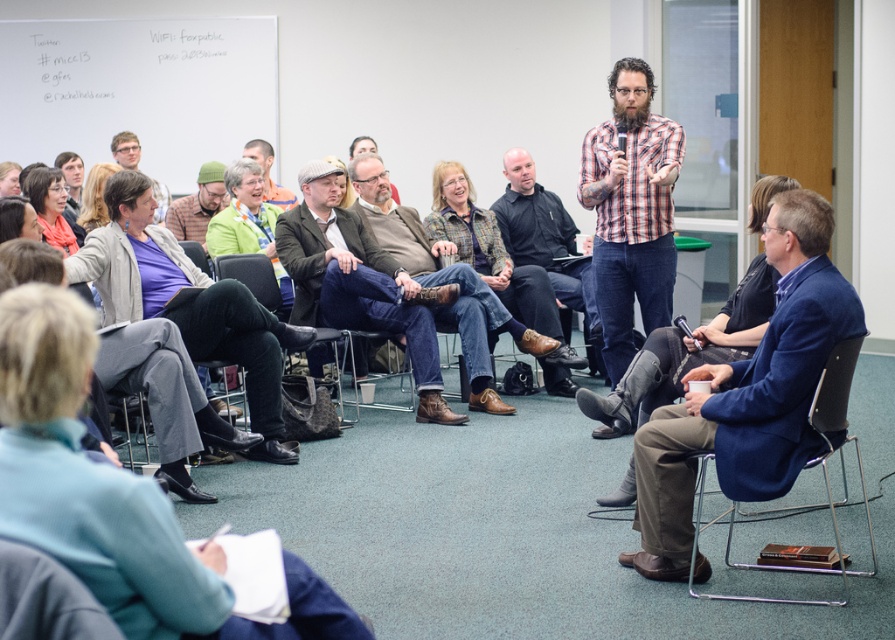
You are standing in the conference room and see the green knit cap at center. If you want to reach it without moving any chairs, can you walk straight ahead from your current position?

The green knit cap at center is 6.29 meters away from you, so yes, you can walk straight ahead to reach it without moving any chairs as there is enough space between you and the cap.

Consider the image. What is the color of the object located at point (198, 204)?

The object at point (198, 204) is green.

You are organizing a small event and need to seat two guests. You have a blue fabric chair at lower right and a denim fabric chair at center. Which chair can accommodate a wider guest more comfortably?

The blue fabric chair at lower right can accommodate a wider guest more comfortably since its width surpasses that of the denim fabric chair at center.